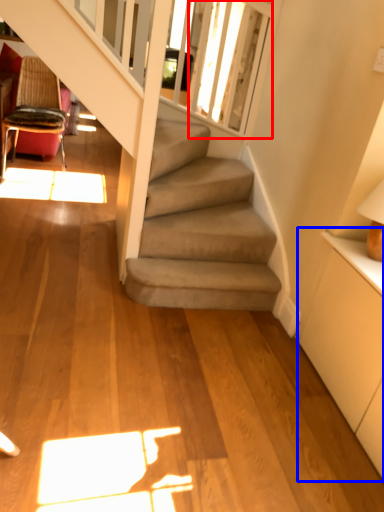
Question: Which object is further to the camera taking this photo, window screen (highlighted by a red box) or dresser (highlighted by a blue box)?

Choices:
 (A) window screen
 (B) dresser

Answer: (A)